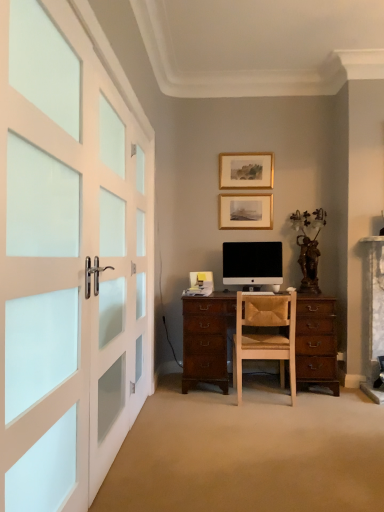
Question: Is point 283,347 positioned closer to the camera than point 268,268?

Choices:
 (A) closer
 (B) farther

Answer: (A)

Question: Considering the positions of light brown wood chair at center and black matte computer monitor at center in the image, is light brown wood chair at center wider or thinner than black matte computer monitor at center?

Choices:
 (A) thin
 (B) wide

Answer: (B)

Question: Which object is positioned closest to the white frosted glass doors at left?

Choices:
 (A) wooden picture frame at center, which ranks as the second picture frame in top-to-bottom order
 (B) light brown wood chair at center
 (C) gold/glossy picture frame at upper center, which is the second picture frame in bottom-to-top order
 (D) black matte computer monitor at center

Answer: (B)

Question: Based on their relative distances, which object is nearer to the white frosted glass doors at left?

Choices:
 (A) light brown wood chair at center
 (B) black matte computer monitor at center
 (C) gold/glossy picture frame at upper center, which is the second picture frame in bottom-to-top order
 (D) wooden picture frame at center, which ranks as the second picture frame in top-to-bottom order

Answer: (A)